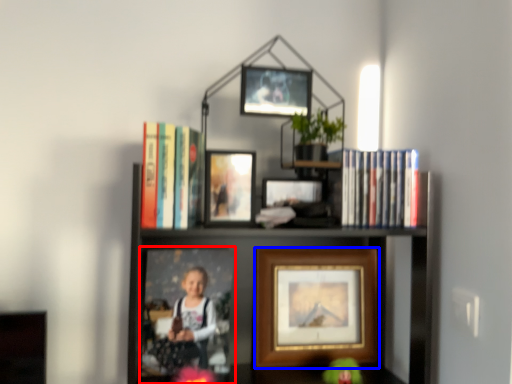
Question: Which object appears closest to the camera in this image, picture frame (highlighted by a red box) or picture frame (highlighted by a blue box)?

Choices:
 (A) picture frame
 (B) picture frame

Answer: (A)